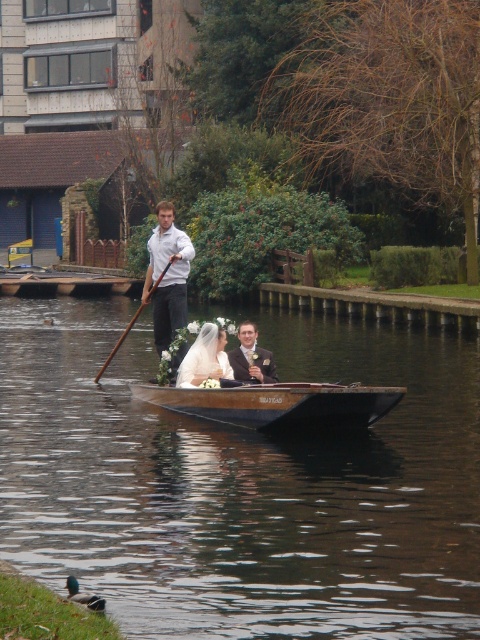
You are a photographer positioned at the edge of the water. You want to capture a photo of the brown wooden canoe at center and the matte black suit at center. Which object should you focus on first to ensure both are in frame?

The brown wooden canoe at center is in front of the matte black suit at center, so you should focus on the matte black suit at center first to ensure both are in frame.

You are standing on the dock and see the point at coordinates point (276, 403). Which object is this point located on?

The point (276, 403) is located on the brown wooden canoe at center.

You are a photographer planning to take a photo of the brown wooden boat at center and the matte white dress at center. Based on their positions, which object is closer to the camera?

The matte white dress at center is closer to the camera because the brown wooden boat at center is positioned under it.